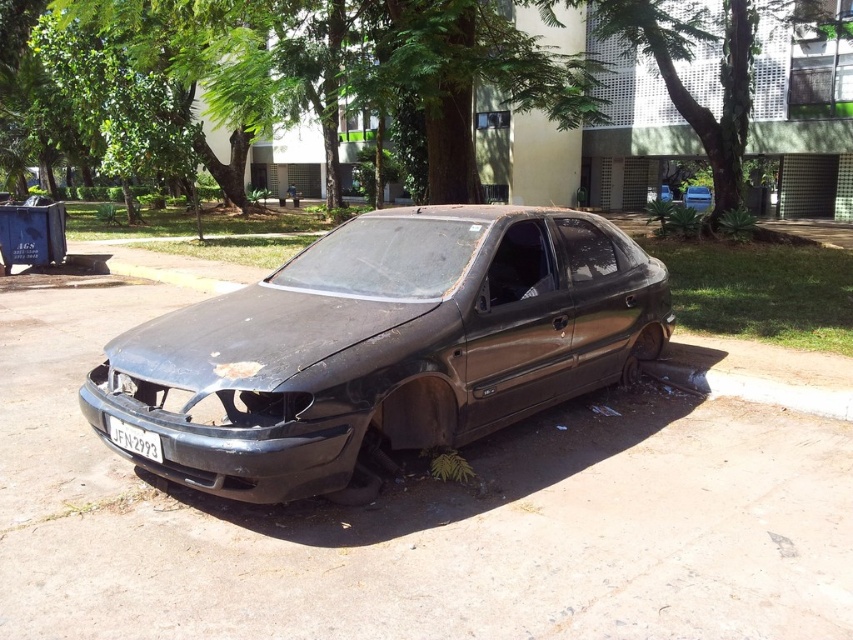
Can you confirm if black matte license plate at lower center is shorter than rusty metal tire at lower right?

Yes, black matte license plate at lower center is shorter than rusty metal tire at lower right.

Does black matte license plate at lower center have a smaller size compared to rusty metal tire at lower right?

Yes.

Who is more distant from viewer, (151, 442) or (656, 348)?

The point (656, 348) is behind.

Find the location of a particular element. black matte license plate at lower center is located at coordinates (134, 440).

Between dull metallic car at center and rusty metal tire at lower right, which one is positioned lower?

rusty metal tire at lower right

Can you confirm if dull metallic car at center is shorter than rusty metal tire at lower right?

No, dull metallic car at center is not shorter than rusty metal tire at lower right.

Between point (202, 476) and point (637, 358), which one is positioned behind?

Positioned behind is point (637, 358).

Image resolution: width=853 pixels, height=640 pixels. Find the location of `dull metallic car at center`. dull metallic car at center is located at coordinates coord(383,346).

Is dull metallic car at center wider than black matte license plate at lower center?

Yes.

Between dull metallic car at center and black matte license plate at lower center, which one has less height?

Standing shorter between the two is black matte license plate at lower center.

Where is `dull metallic car at center`? The width and height of the screenshot is (853, 640). dull metallic car at center is located at coordinates (383, 346).

You are a GUI agent. You are given a task and a screenshot of the screen. Output one action in this format:
    pyautogui.click(x=<x>, y=<y>)
    Task: Click on the dull metallic car at center
    The image size is (853, 640).
    Given the screenshot: What is the action you would take?
    pyautogui.click(x=383, y=346)